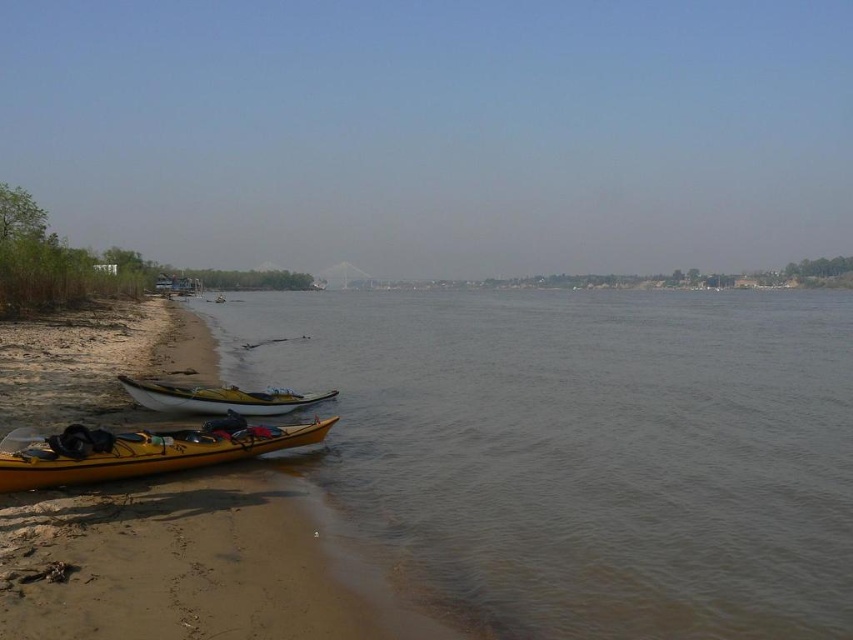
Is brown matte water at center bigger than white matte canoe at lower left?

Correct, brown matte water at center is larger in size than white matte canoe at lower left.

In the scene shown: Who is more forward, (x=734, y=579) or (x=231, y=394)?

Point (x=734, y=579) is more forward.

Does point (434, 502) lie behind point (132, 380)?

No, (434, 502) is in front of (132, 380).

Image resolution: width=853 pixels, height=640 pixels. I want to click on brown matte water at center, so click(584, 451).

Can you confirm if brown matte water at center is bigger than yellow matte canoe at lower left?

Yes, brown matte water at center is bigger than yellow matte canoe at lower left.

This screenshot has width=853, height=640. Describe the element at coordinates (584, 451) in the screenshot. I see `brown matte water at center` at that location.

Between point (577, 296) and point (206, 444), which one is positioned in front?

Positioned in front is point (206, 444).

Find the location of a particular element. This screenshot has height=640, width=853. brown matte water at center is located at coordinates (584, 451).

Who is lower down, yellow matte canoe at lower left or white matte canoe at lower left?

yellow matte canoe at lower left is lower down.

Who is shorter, yellow matte canoe at lower left or white matte canoe at lower left?

yellow matte canoe at lower left

Is point (146, 451) closer to viewer compared to point (183, 387)?

Yes, it is.

Locate an element on the screen. yellow matte canoe at lower left is located at coordinates (140, 451).